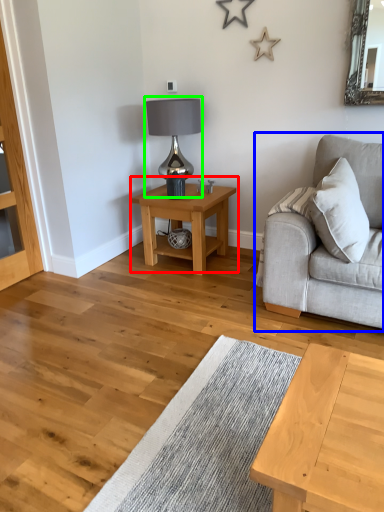
Question: Considering the real-world distances, which object is closest to table (highlighted by a red box)? studio couch (highlighted by a blue box) or table lamp (highlighted by a green box).

Choices:
 (A) studio couch
 (B) table lamp

Answer: (B)